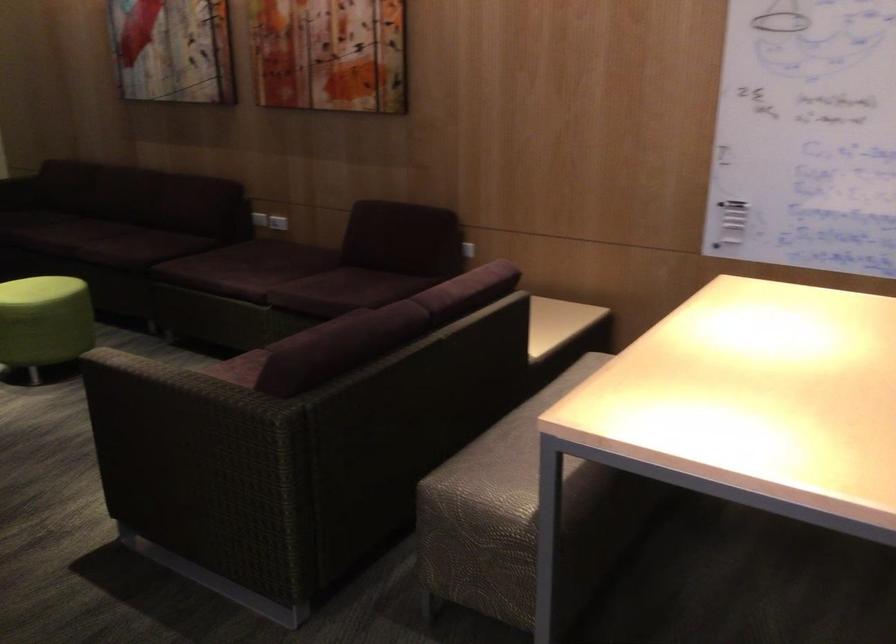
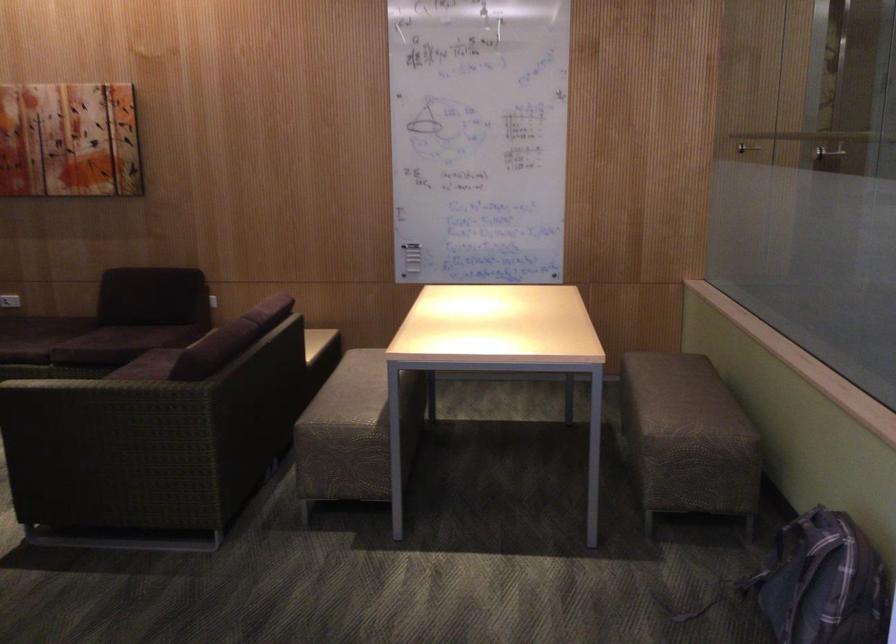
The point at (470, 258) is marked in the first image. Where is the corresponding point in the second image?

(210, 301)